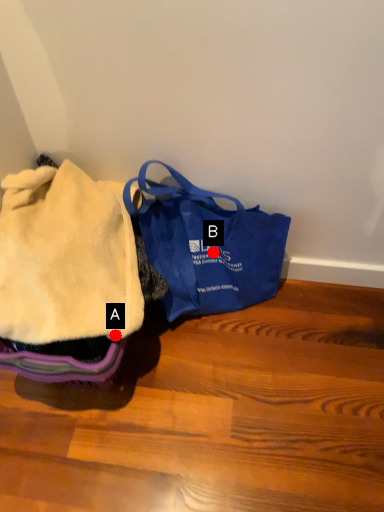
Question: Two points are circled on the image, labeled by A and B beside each circle. Among these points, which one is farthest from the camera?

Choices:
 (A) A is further
 (B) B is further

Answer: (B)